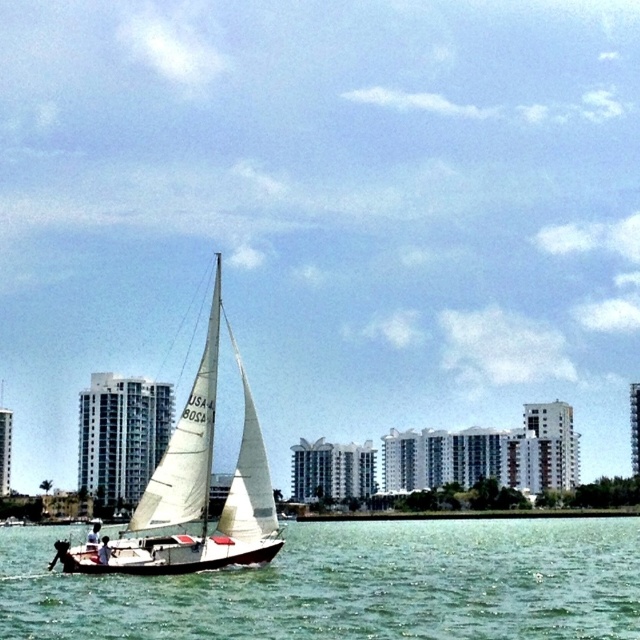
Question: Which object appears farthest from the camera in this image?

Choices:
 (A) green water at center
 (B) white sailboat at center

Answer: (B)

Question: Is green water at center to the right of white sailboat at center from the viewer's perspective?

Choices:
 (A) yes
 (B) no

Answer: (A)

Question: Is green water at center below white sailboat at center?

Choices:
 (A) yes
 (B) no

Answer: (A)

Question: Can you confirm if green water at center is bigger than white sailboat at center?

Choices:
 (A) yes
 (B) no

Answer: (B)

Question: Among these points, which one is farthest from the camera?

Choices:
 (A) (344, 566)
 (B) (209, 445)

Answer: (A)